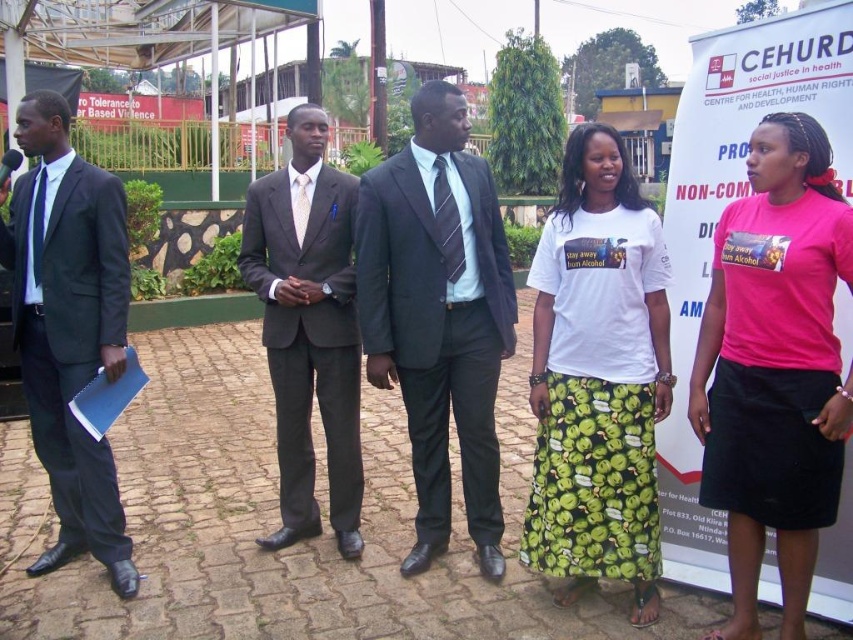
Question: Does matte black suit at center appear on the left side of matte black suit at left?

Choices:
 (A) no
 (B) yes

Answer: (A)

Question: Is white cotton t-shirt at center positioned behind matte gray suit at center?

Choices:
 (A) yes
 (B) no

Answer: (B)

Question: Which object appears closest to the camera in this image?

Choices:
 (A) blue matte folder at left
 (B) matte gray suit at center
 (C) pink fabric skirt at lower right

Answer: (C)

Question: Can you confirm if white cotton t-shirt at center is wider than matte gray suit at center?

Choices:
 (A) no
 (B) yes

Answer: (A)

Question: Which of the following is the closest to the observer?

Choices:
 (A) matte gray suit at center
 (B) matte black suit at left
 (C) pink fabric skirt at lower right
 (D) white cotton t-shirt at center

Answer: (C)

Question: Which of the following is the closest to the observer?

Choices:
 (A) matte gray suit at center
 (B) pink fabric skirt at lower right

Answer: (B)